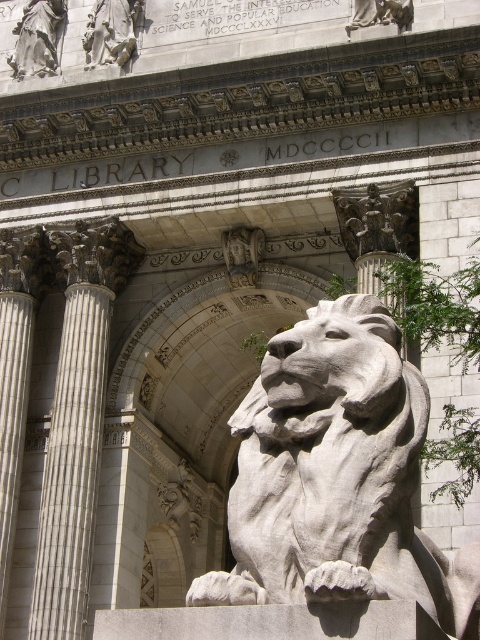
Is point (332, 506) closer to camera compared to point (38, 38)?

Yes, point (332, 506) is in front of point (38, 38).

Who is positioned more to the right, white stone lion at center or polished marble statue at upper left?

From the viewer's perspective, white stone lion at center appears more on the right side.

Who is more forward, (385, 371) or (25, 72)?

Point (385, 371) is more forward.

Locate an element on the screen. This screenshot has width=480, height=640. white stone lion at center is located at coordinates (336, 476).

Is the position of white marble column at left more distant than that of polished marble statue at upper left?

No, white marble column at left is in front of polished marble statue at upper left.

Between white marble column at left and polished marble statue at upper left, which one has more height?

Standing taller between the two is white marble column at left.

You are a GUI agent. You are given a task and a screenshot of the screen. Output one action in this format:
    pyautogui.click(x=<x>, y=<y>)
    Task: Click on the white marble column at left
    
    Given the screenshot: What is the action you would take?
    click(72, 467)

Does polished marble statue at upper left have a greater height compared to polished marble figures at upper left?

No.

Locate an element on the screen. The width and height of the screenshot is (480, 640). polished marble statue at upper left is located at coordinates (37, 38).

Is point (24, 22) farther from viewer compared to point (111, 19)?

Yes, point (24, 22) is behind point (111, 19).

Locate an element on the screen. This screenshot has width=480, height=640. polished marble statue at upper left is located at coordinates (37, 38).